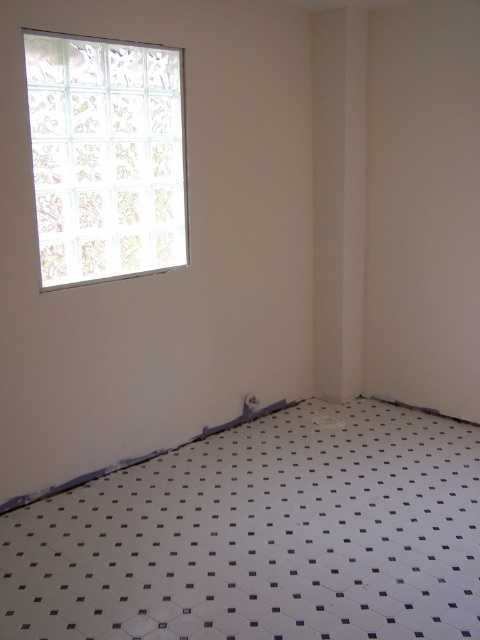
You are standing in the room and want to clean both the white glossy tile at lower center and the frosted glass window at upper left. Which object should you clean first if you want to start with the one that is nearest to you?

You should clean the white glossy tile at lower center first because it is closer to the viewer than the frosted glass window at upper left.

You are a contractor measuring the dimensions of the room. You need to determine which object, the white glossy tile at lower center or the frosted glass window at upper left, has a greater width. Based on the scene, can you make this determination?

The white glossy tile at lower center might be wider than frosted glass window at upper left, so it is possible that the white glossy tile at lower center has a greater width than the frosted glass window at upper left.

You are standing in the room and see the point marked at coordinates (262, 536). According to the scene description, where exactly is this point located?

The point is on the white glossy tile at lower center.